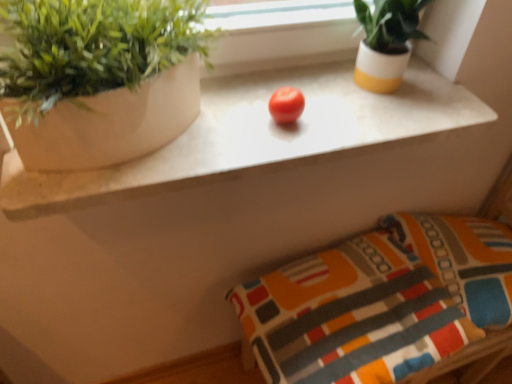
Identify the location of free space between matte white pot at upper left and white glossy pot at upper right. Image resolution: width=512 pixels, height=384 pixels. (301, 113).